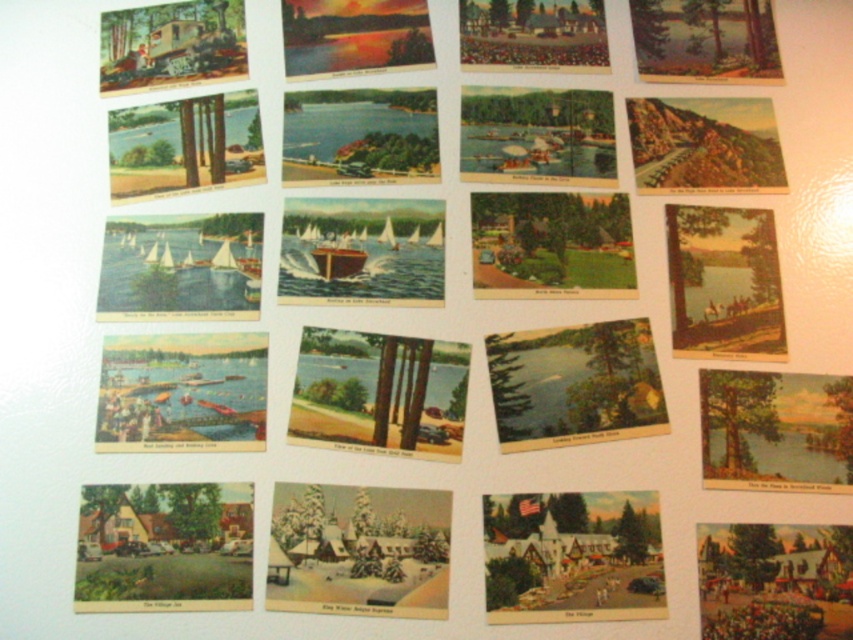
Question: Does matte green car at center have a larger size compared to matte yellow boat at right?

Choices:
 (A) no
 (B) yes

Answer: (B)

Question: Which point is closer to the camera taking this photo?

Choices:
 (A) (686, 67)
 (B) (749, 541)

Answer: (B)

Question: Is matte green car at center positioned in front of matte yellow boat at right?

Choices:
 (A) yes
 (B) no

Answer: (A)

Question: Can you confirm if wooden boat at center is thinner than matte green grass at upper right?

Choices:
 (A) no
 (B) yes

Answer: (A)

Question: Among these objects, which one is farthest from the camera?

Choices:
 (A) pastel wood house at lower right
 (B) snow-covered trees at center

Answer: (B)

Question: Which point is farther to the camera?

Choices:
 (A) olive green canvas tree at center right
 (B) matte brown tree at upper right
 (C) matte green house at bottom left

Answer: (B)